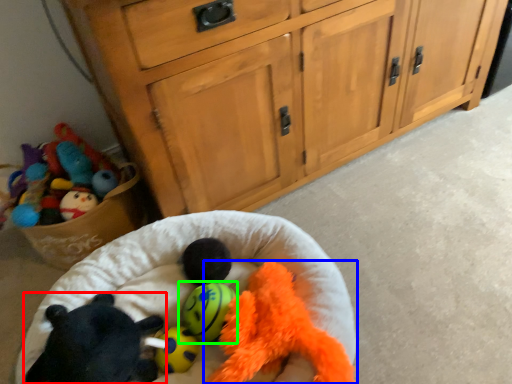
Question: Which object is positioned closest to toy (highlighted by a red box)? Select from toy (highlighted by a blue box) and toy (highlighted by a green box).

Choices:
 (A) toy
 (B) toy

Answer: (B)